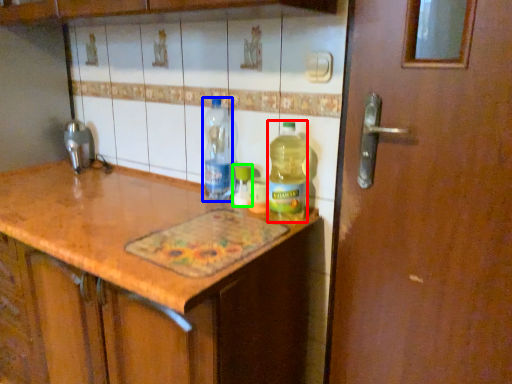
Question: Considering the real-world distances, which object is farthest from bottle (highlighted by a red box)? bottle (highlighted by a blue box) or bottle (highlighted by a green box)?

Choices:
 (A) bottle
 (B) bottle

Answer: (A)